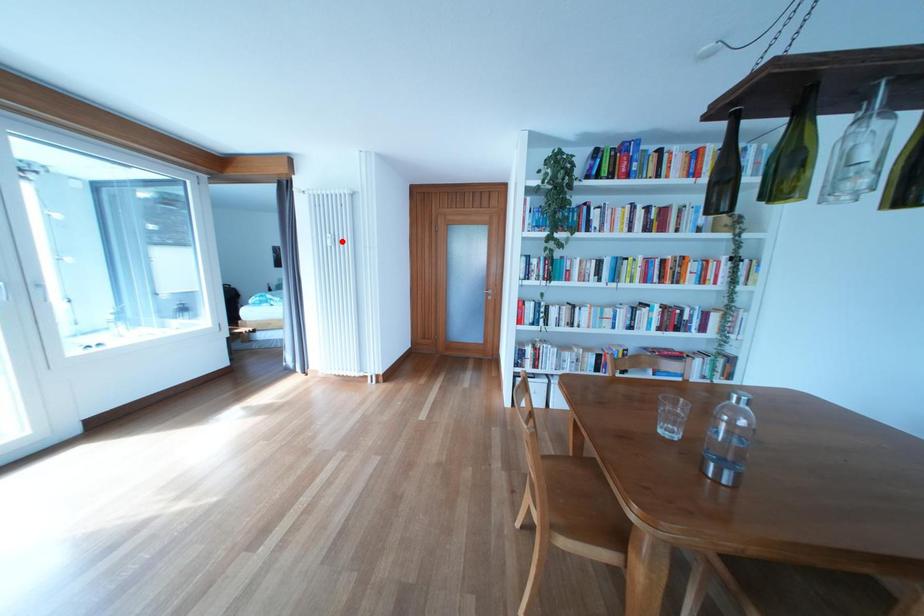
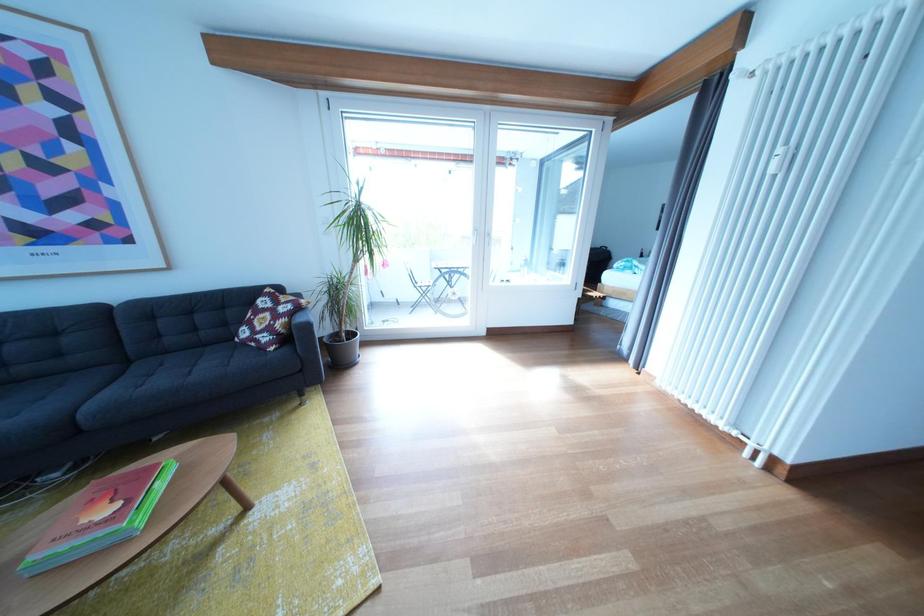
Find the pixel in the second image that matches the highlighted location in the first image.

(793, 156)